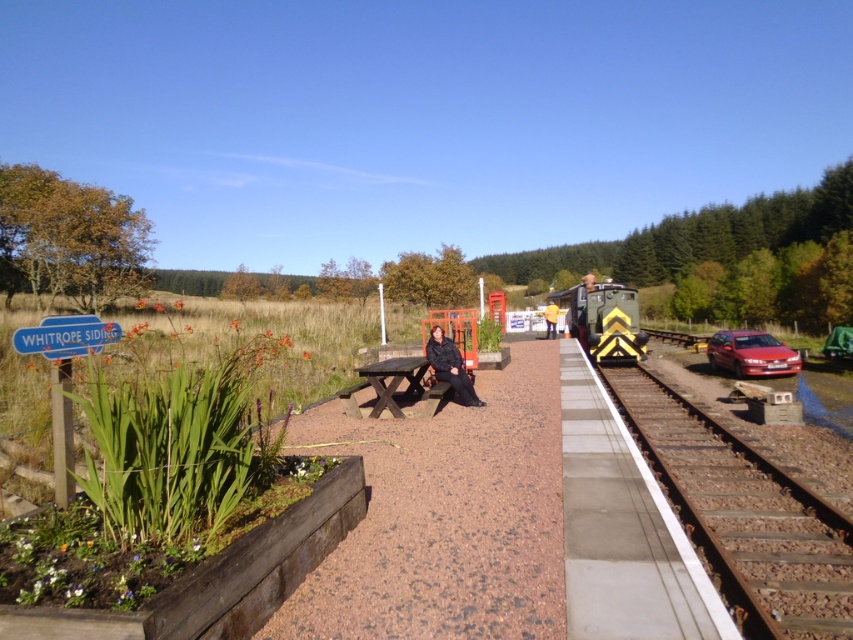
You are standing on the platform at the rural railway station and want to place a small potted plant between the rusty metal train track at right and the black fabric jacket at center. Based on their positions, which object should the potted plant be closer to?

The rusty metal train track at right is closer to the viewer than the black fabric jacket at center, so the potted plant should be placed closer to the rusty metal train track at right to maintain the spatial relationship between the objects.

In the scene shown: You are standing on the platform at the rural railway station and notice a black fabric jacket at center. If you want to pick it up, which direction should you move relative to the garden bed with lush green plants to your left?

The black fabric jacket at center is located at point 0.573 on the x and 0.529 on the y coordinate. Since the garden bed is on the left side of the platform, you should move towards the right to reach the jacket.

You are a maintenance worker needing to reach the rusty metal train track at right from your current position near the black fabric jacket at center. Given that your toolbag can only hold items within a 10 feet radius, will you be able to carry your tools while moving to the track without needing to return for more?

The rusty metal train track at right and black fabric jacket at center are 13.08 feet apart. Since the distance exceeds the 10 feet radius of your toolbag, you will need to return for more tools as you cannot carry them the entire distance.